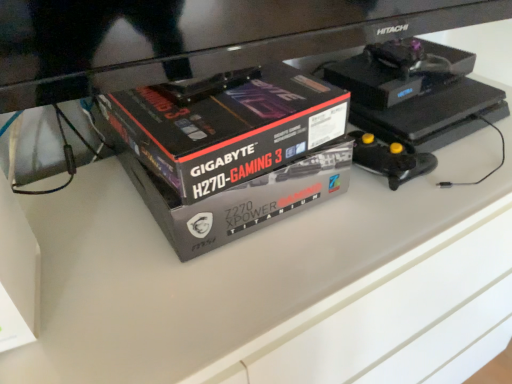
You are a GUI agent. You are given a task and a screenshot of the screen. Output one action in this format:
    pyautogui.click(x=<x>, y=<y>)
    Task: Click on the free spot above black glossy box at center, which is the 2th box in left-to-right order (from a real-world perspective)
    
    Given the screenshot: What is the action you would take?
    pyautogui.click(x=211, y=87)